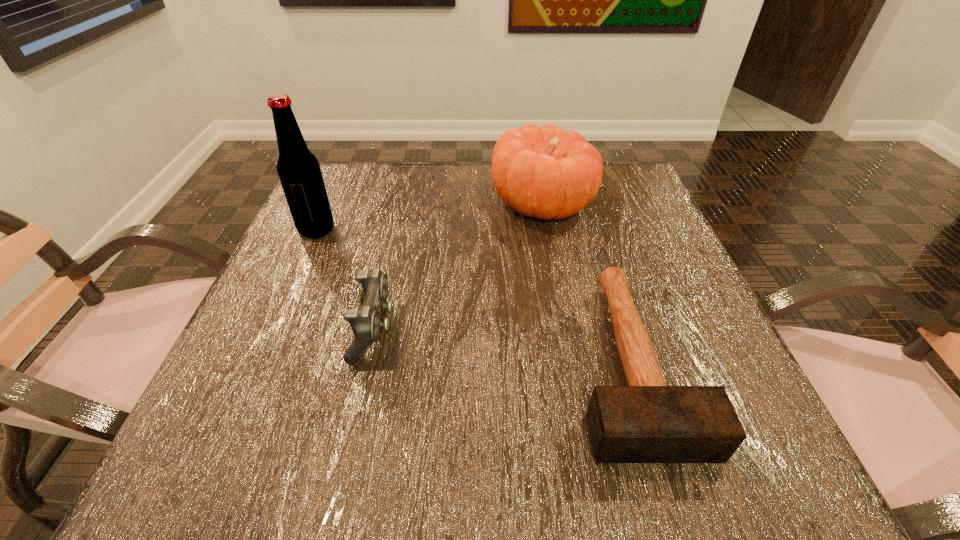
Find the location of `blank region between the pumpkin and the beer bottle`. blank region between the pumpkin and the beer bottle is located at coordinates (430, 217).

Find the location of a particular element. This screenshot has height=540, width=960. vacant region between the mallet and the leftmost object is located at coordinates (473, 295).

Where is `object that is the third closest one to the beer bottle`? This screenshot has width=960, height=540. object that is the third closest one to the beer bottle is located at coordinates (647, 421).

Identify which object is located as the third nearest to the shortest object. Please provide its 2D coordinates. Your answer should be formatted as a tuple, i.e. [(x, y)], where the tuple contains the x and y coordinates of a point satisfying the conditions above.

[(298, 169)]

Locate an element on the screen. This screenshot has width=960, height=540. vacant space that satisfies the following two spatial constraints: 1. on the back side of the third shortest object; 2. on the right side of the beer bottle is located at coordinates (328, 204).

Locate an element on the screen. This screenshot has width=960, height=540. vacant space that satisfies the following two spatial constraints: 1. on the front side of the pumpkin; 2. on the surface of the third object from right to left with buttons is located at coordinates (565, 330).